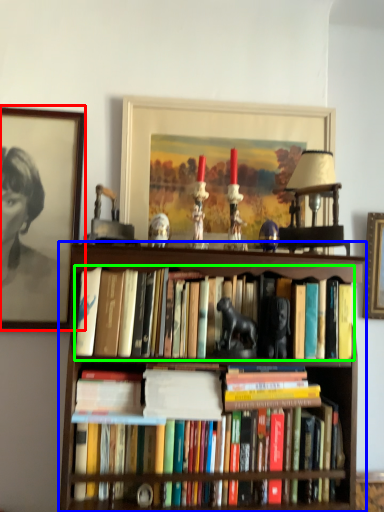
Question: Considering the real-world distances, which object is farthest from picture frame (highlighted by a red box)? bookcase (highlighted by a blue box) or book (highlighted by a green box)?

Choices:
 (A) bookcase
 (B) book

Answer: (B)